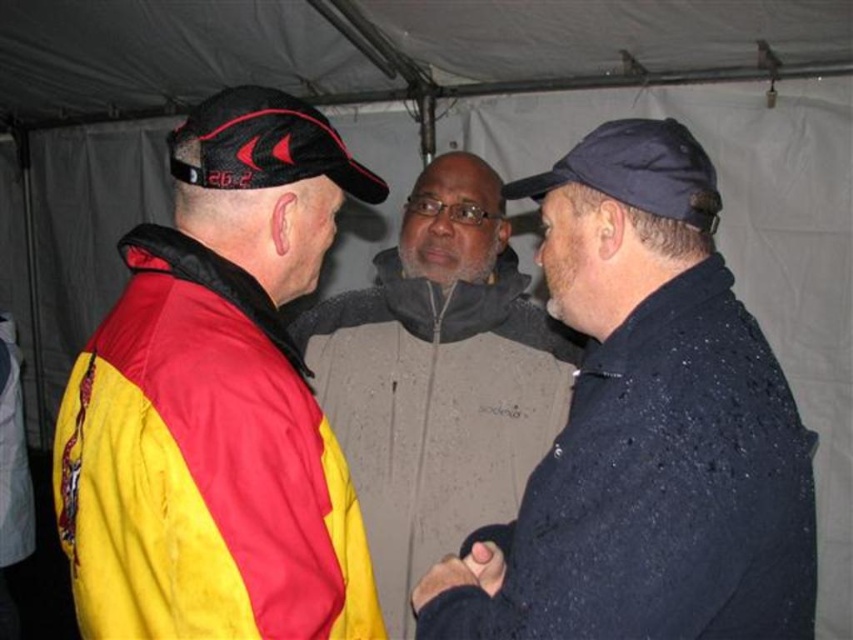
Can you confirm if dark blue textured jacket at center is thinner than black leather glove at center?

Incorrect, dark blue textured jacket at center's width is not less than black leather glove at center's.

Based on the photo, does dark blue textured jacket at center have a lesser height compared to black leather glove at center?

No.

At what (x,y) coordinates should I click in order to perform the action: click on dark blue textured jacket at center. Please return your answer as a coordinate pair (x, y). This screenshot has height=640, width=853. Looking at the image, I should click on (651, 426).

I want to click on dark blue textured jacket at center, so click(x=651, y=426).

Between matte black jacket at center and black matte hand at center, which one is positioned higher?

Positioned higher is matte black jacket at center.

Image resolution: width=853 pixels, height=640 pixels. What do you see at coordinates (439, 372) in the screenshot?
I see `matte black jacket at center` at bounding box center [439, 372].

Find the location of a particular element. This screenshot has width=853, height=640. matte black jacket at center is located at coordinates (439, 372).

Where is `matte black jacket at center`? The height and width of the screenshot is (640, 853). matte black jacket at center is located at coordinates (439, 372).

Is matte black jacket at center bigger than black mesh cap at upper left?

Yes, matte black jacket at center is bigger than black mesh cap at upper left.

Who is more forward, [375,275] or [212,120]?

Point [212,120] is in front.

Locate an element on the screen. The width and height of the screenshot is (853, 640). matte black jacket at center is located at coordinates (439, 372).